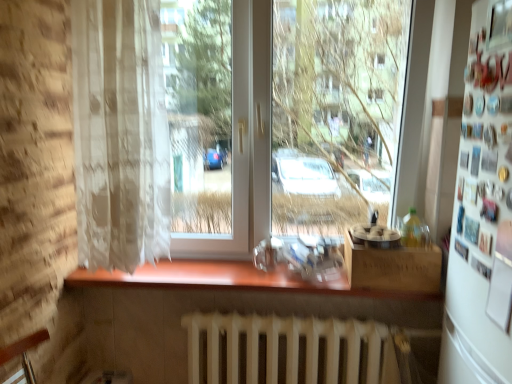
Question: Considering the relative sizes of wooden counter at center and white matte radiator at lower center in the image provided, is wooden counter at center smaller than white matte radiator at lower center?

Choices:
 (A) yes
 (B) no

Answer: (A)

Question: Can you confirm if wooden counter at center is taller than white matte radiator at lower center?

Choices:
 (A) yes
 (B) no

Answer: (B)

Question: From a real-world perspective, is wooden counter at center located beneath white matte radiator at lower center?

Choices:
 (A) no
 (B) yes

Answer: (A)

Question: From the image's perspective, does wooden counter at center appear lower than white matte radiator at lower center?

Choices:
 (A) yes
 (B) no

Answer: (B)

Question: Does wooden counter at center touch white matte radiator at lower center?

Choices:
 (A) no
 (B) yes

Answer: (A)

Question: From the image's perspective, relative to wooden box at lower right, is white matte refrigerator at right above or below?

Choices:
 (A) below
 (B) above

Answer: (B)

Question: Considering the relative positions of white matte refrigerator at right and wooden box at lower right in the image provided, is white matte refrigerator at right to the left or to the right of wooden box at lower right?

Choices:
 (A) left
 (B) right

Answer: (B)

Question: Is point (500, 334) closer or farther from the camera than point (350, 251)?

Choices:
 (A) closer
 (B) farther

Answer: (A)

Question: Relative to wooden box at lower right, is white matte refrigerator at right in front or behind?

Choices:
 (A) behind
 (B) front

Answer: (B)

Question: Would you say white lace curtain at left is to the left or to the right of white matte refrigerator at right in the picture?

Choices:
 (A) left
 (B) right

Answer: (A)

Question: From their relative heights in the image, would you say white lace curtain at left is taller or shorter than white matte refrigerator at right?

Choices:
 (A) short
 (B) tall

Answer: (B)

Question: Is white lace curtain at left wider or thinner than white matte refrigerator at right?

Choices:
 (A) thin
 (B) wide

Answer: (B)

Question: Is white lace curtain at left spatially inside white matte refrigerator at right, or outside of it?

Choices:
 (A) inside
 (B) outside

Answer: (B)

Question: Is white lace curtain at left situated inside white matte radiator at lower center or outside?

Choices:
 (A) inside
 (B) outside

Answer: (B)

Question: Based on their sizes in the image, would you say white lace curtain at left is bigger or smaller than white matte radiator at lower center?

Choices:
 (A) big
 (B) small

Answer: (B)